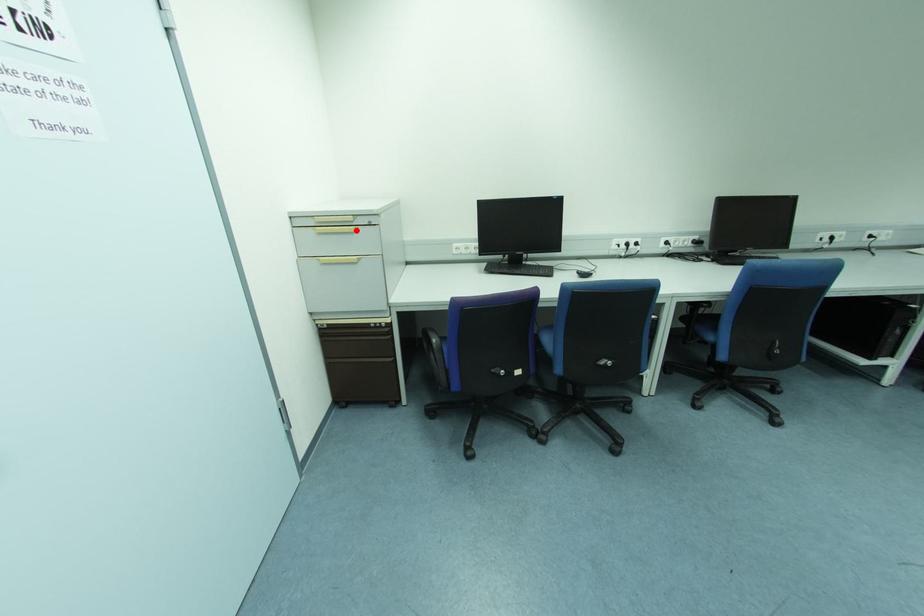
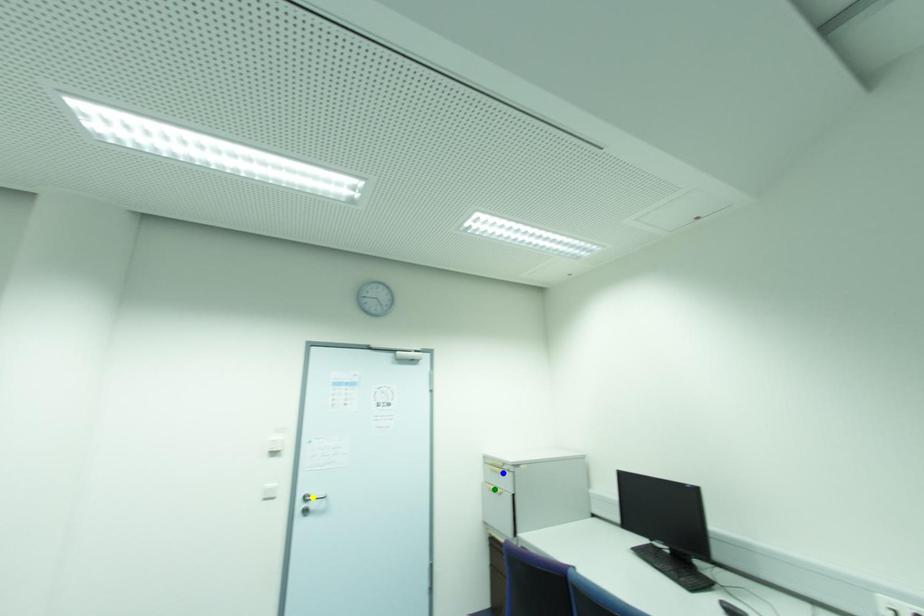
Question: I am providing you with two images of the same scene from different viewpoints. A red point is marked on the first image. You are given multiple points on the second image. Can you choose the point in image 2 that corresponds to the point in image 1?

Choices:
 (A) blue point
 (B) green point
 (C) yellow point

Answer: (A)